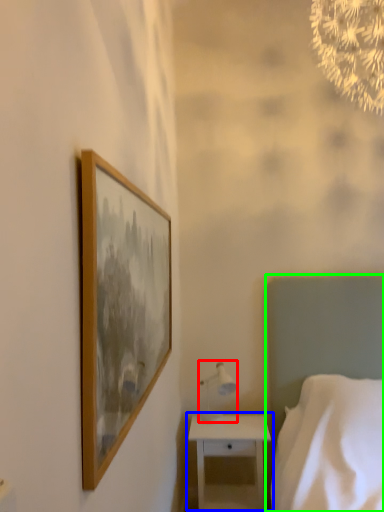
Question: Which is nearer to the table lamp (highlighted by a red box)? nightstand (highlighted by a blue box) or bed (highlighted by a green box).

Choices:
 (A) nightstand
 (B) bed

Answer: (A)